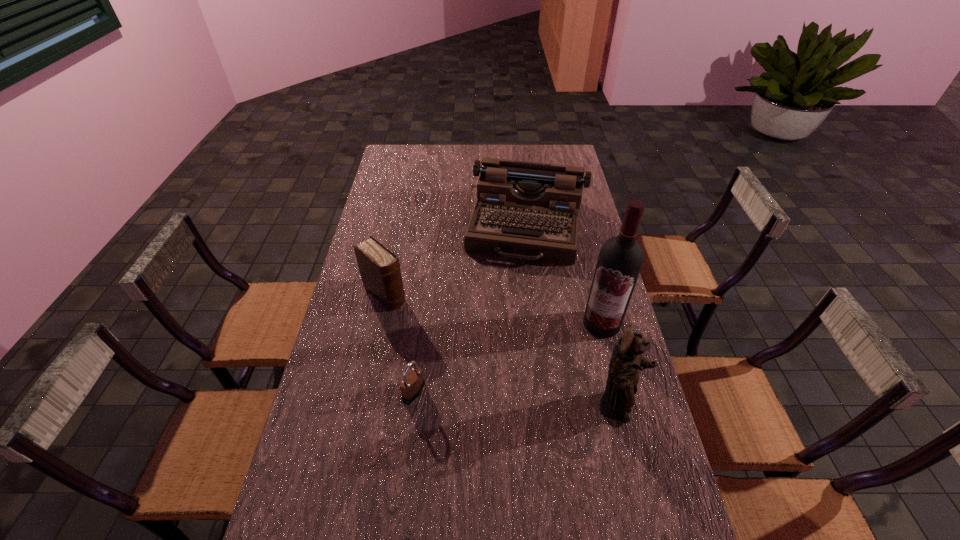
You are a GUI agent. You are given a task and a screenshot of the screen. Output one action in this format:
    pyautogui.click(x=<x>, y=<y>)
    Task: Click on the vacant space located 0.190m on the keyboard of the typewriter
    The height and width of the screenshot is (540, 960).
    Given the screenshot: What is the action you would take?
    pyautogui.click(x=512, y=306)

At what (x,y) coordinates should I click in order to perform the action: click on vacant region located on the spine side of the diary. Please return your answer as a coordinate pair (x, y). Looking at the image, I should click on (458, 360).

Locate an element on the screen. free space located on the spine side of the diary is located at coordinates (465, 366).

The width and height of the screenshot is (960, 540). In order to click on blank space located on the spine side of the diary in this screenshot , I will do `click(436, 340)`.

Image resolution: width=960 pixels, height=540 pixels. I want to click on vacant space located on the label of the tallest object, so click(x=577, y=347).

Identify the location of free spot located 0.270m on the label of the tallest object. Image resolution: width=960 pixels, height=540 pixels. (535, 389).

Locate an element on the screen. Image resolution: width=960 pixels, height=540 pixels. free space located 0.240m on the label of the tallest object is located at coordinates (541, 382).

Identify the location of object that is at the left edge. (379, 267).

Identify the location of figurine that is at the right edge. The image size is (960, 540). (623, 374).

Identify the location of typewriter that is at the right edge. The width and height of the screenshot is (960, 540). (525, 210).